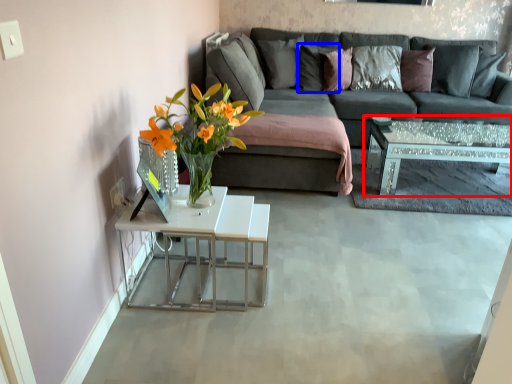
Question: Which of the following is the farthest to the observer, coffee table (highlighted by a red box) or pillow (highlighted by a blue box)?

Choices:
 (A) coffee table
 (B) pillow

Answer: (B)